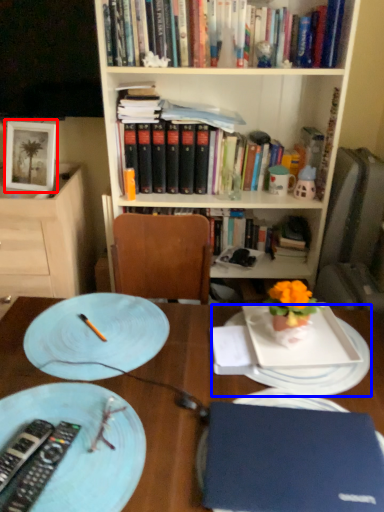
Question: Which object is closer to the camera taking this photo, picture frame (highlighted by a red box) or platter (highlighted by a blue box)?

Choices:
 (A) picture frame
 (B) platter

Answer: (B)